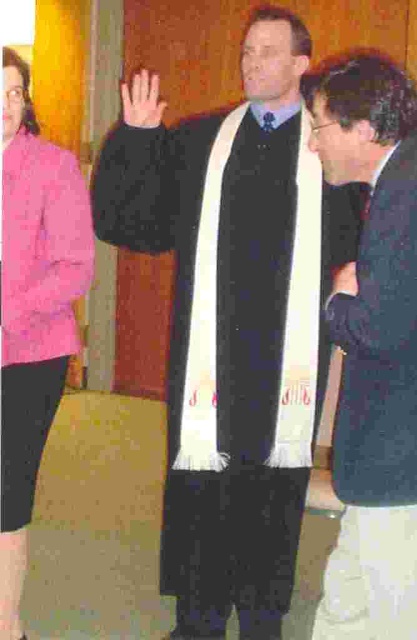
Is smooth skin hand at center thinner than matte black hand at center?

Incorrect, smooth skin hand at center's width is not less than matte black hand at center's.

Is point (156, 112) in front of point (348, 280)?

That is False.

Describe the element at coordinates (142, 100) in the screenshot. I see `smooth skin hand at center` at that location.

Locate an element on the screen. smooth skin hand at center is located at coordinates pyautogui.click(x=142, y=100).

Is matte black hand at center wider than matte purple tie at center?

Yes.

Between matte black hand at center and matte purple tie at center, which one has less height?

matte purple tie at center

Who is more distant from viewer, (354, 289) or (261, 125)?

The point (261, 125) is behind.

This screenshot has width=417, height=640. What are the coordinates of `matte black hand at center` in the screenshot? It's located at (346, 280).

Between pink fabric jacket at left and matte purple tie at center, which one appears on the right side from the viewer's perspective?

Positioned to the right is matte purple tie at center.

This screenshot has height=640, width=417. In order to click on pink fabric jacket at left in this screenshot , I will do `click(34, 310)`.

Does point (20, 513) come farther from viewer compared to point (274, 122)?

That is False.

The height and width of the screenshot is (640, 417). In order to click on pink fabric jacket at left in this screenshot , I will do `click(34, 310)`.